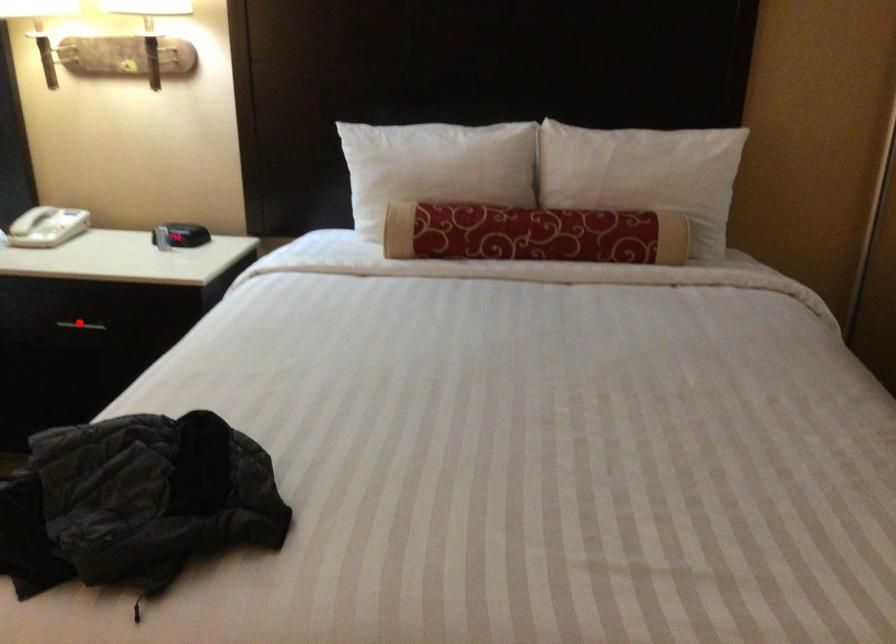
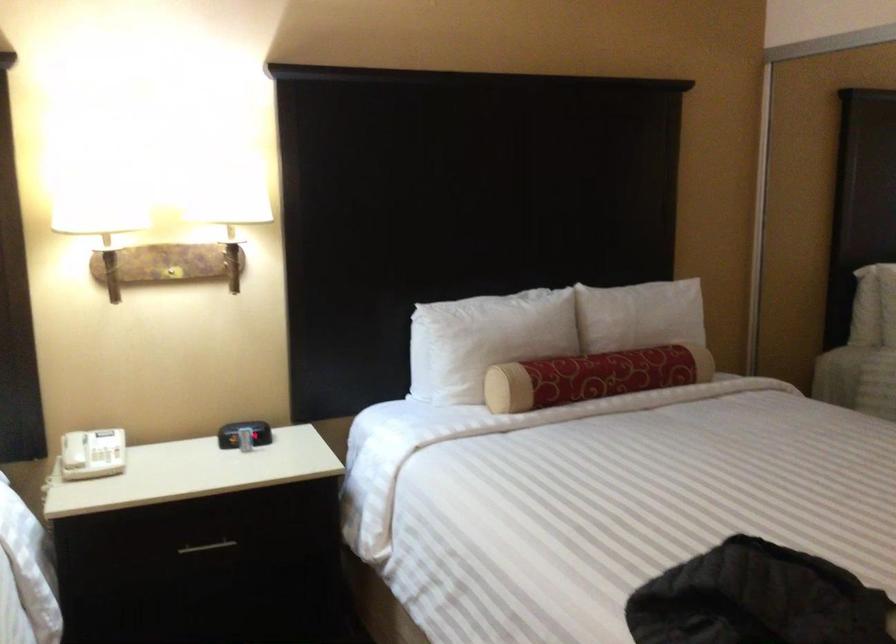
Question: I am providing you with two images of the same scene from different viewpoints. In image1, a red point is highlighted. Considering the same 3D point in image2, which of the following is correct?

Choices:
 (A) It is closer
 (B) It is farther

Answer: (A)